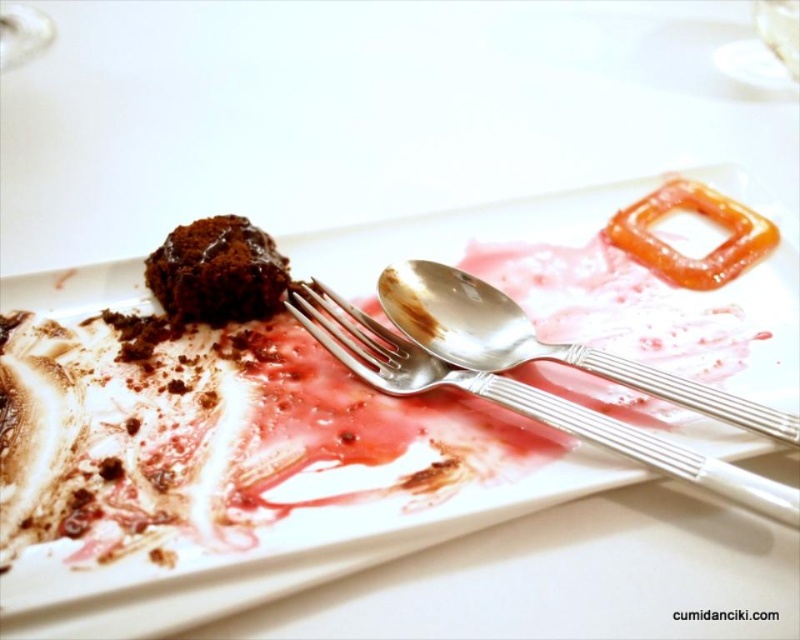
Question: Is silver polished fork at center to the left of translucent orange pretzel at upper right from the viewer's perspective?

Choices:
 (A) no
 (B) yes

Answer: (B)

Question: Is white glossy plate at center smaller than chocolate matte cake at upper left?

Choices:
 (A) no
 (B) yes

Answer: (A)

Question: Can you confirm if white glossy plate at center is thinner than chocolate matte cake at upper left?

Choices:
 (A) yes
 (B) no

Answer: (B)

Question: Which point is farther to the camera?

Choices:
 (A) 750,248
 (B) 10,524

Answer: (A)

Question: Estimate the real-world distances between objects in this image. Which object is farther from the chocolate matte cake at upper left?

Choices:
 (A) silver polished fork at center
 (B) white glossy plate at center

Answer: (B)

Question: Among these objects, which one is farthest from the camera?

Choices:
 (A) silver polished fork at center
 (B) white glossy plate at center

Answer: (A)